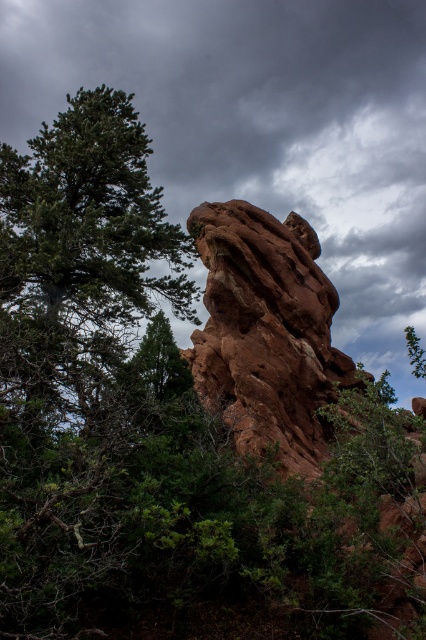
Question: Which object is closer to the camera taking this photo?

Choices:
 (A) green matte tree at center
 (B) green matte tree at upper left
 (C) rustic stone rock at center
 (D) dark gray cloudy sky at upper center

Answer: (B)

Question: Which point appears closest to the camera in this image?

Choices:
 (A) (184, 358)
 (B) (412, 356)
 (C) (279, 394)
 (D) (124, 93)

Answer: (B)

Question: Can you confirm if dark gray cloudy sky at upper center is bigger than green matte tree at upper center?

Choices:
 (A) yes
 (B) no

Answer: (A)

Question: Can you confirm if rustic stone rock at center is positioned to the left of green matte tree at center?

Choices:
 (A) no
 (B) yes

Answer: (A)

Question: Is green matte tree at upper left smaller than green matte tree at upper center?

Choices:
 (A) yes
 (B) no

Answer: (A)

Question: Which is nearer to the dark gray cloudy sky at upper center?

Choices:
 (A) green matte tree at upper center
 (B) rustic stone rock at center
 (C) green matte tree at upper left
 (D) green matte tree at center

Answer: (B)